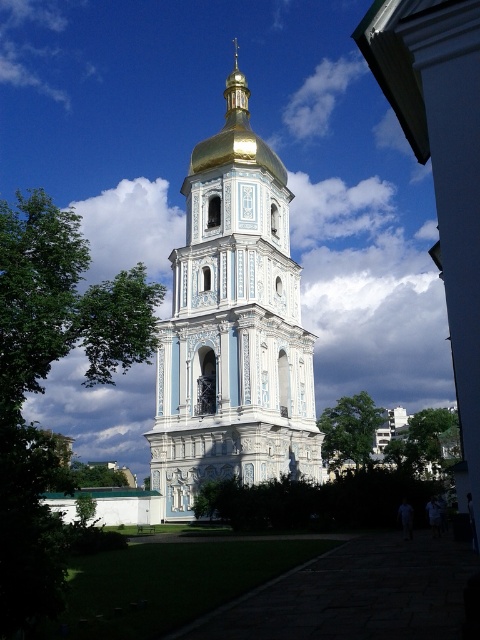
Is point (357, 448) farther from viewer compared to point (93, 484)?

No, it is not.

Between point (349, 417) and point (85, 477), which one is positioned in front?

Positioned in front is point (349, 417).

Which is in front, point (357, 468) or point (72, 481)?

Point (72, 481) is more forward.

At what (x,y) coordinates should I click in order to perform the action: click on green leafy tree at center. Please return your answer as a coordinate pair (x, y). Looking at the image, I should click on (349, 429).

Is green leafy tree at left smaller than green leafy tree at lower left?

No, green leafy tree at left is not smaller than green leafy tree at lower left.

Can you confirm if green leafy tree at left is positioned above green leafy tree at lower left?

Yes, green leafy tree at left is above green leafy tree at lower left.

Is point (16, 376) closer to viewer compared to point (94, 474)?

That is True.

Locate an element on the screen. The width and height of the screenshot is (480, 640). green leafy tree at left is located at coordinates (46, 376).

Can you confirm if green leafy tree at left is positioned to the right of green leafy tree at center?

In fact, green leafy tree at left is to the left of green leafy tree at center.

Is green leafy tree at left wider than green leafy tree at center?

Correct, the width of green leafy tree at left exceeds that of green leafy tree at center.

Is point (129, 321) more distant than point (344, 448)?

No, (129, 321) is closer to viewer.

You are a GUI agent. You are given a task and a screenshot of the screen. Output one action in this format:
    pyautogui.click(x=<x>, y=<y>)
    Task: Click on the green leafy tree at left
    Image resolution: width=480 pixels, height=640 pixels.
    Given the screenshot: What is the action you would take?
    pyautogui.click(x=46, y=376)